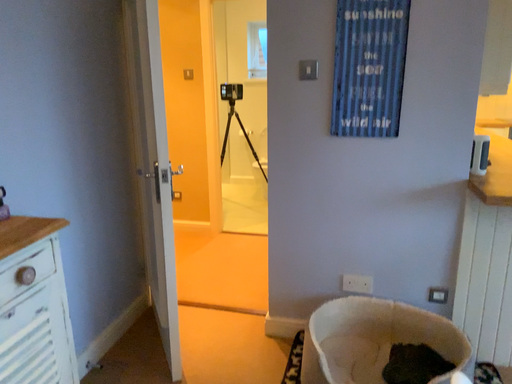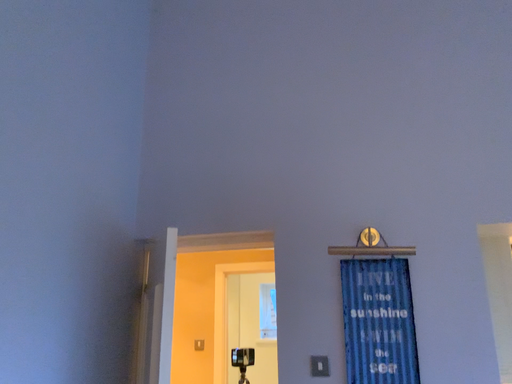
Question: How did the camera likely rotate when shooting the video?

Choices:
 (A) rotated downward
 (B) rotated upward

Answer: (B)